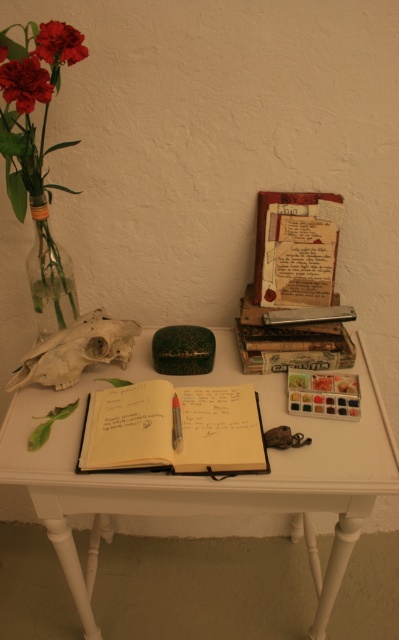
You are an artist who wants to place a new sculpture between the matte red flower at upper left and the metallic silver notebook at center. Which object should the sculpture be closer to if it needs to be placed in front of the notebook?

The sculpture should be placed closer to the matte red flower at upper left because it is already in front of the metallic silver notebook at center, so positioning the sculpture near the flower would maintain the front position relative to the notebook.

You are an artist who needs to place a 30 inch long sculpture on the table. Based on the distance between the white wooden table at center and the matte red carnation at upper left, will the sculpture fit horizontally on the table without overlapping the carnation?

The white wooden table at center is 28.68 inches away from the matte red carnation at upper left. Since the sculpture is 30 inches long, it would extend beyond the space between them, so it might overlap the carnation. Therefore, the sculpture might not fit without overlapping.

You are an artist who needs to place a 10cm wide paintbrush on the table. The matte red flower at upper left and the metallic silver notebook at center are already there. Which object has enough space around it to accommodate the paintbrush?

The metallic silver notebook at center is larger than the matte red flower at upper left, so there is more space around it to place the 10cm wide paintbrush.